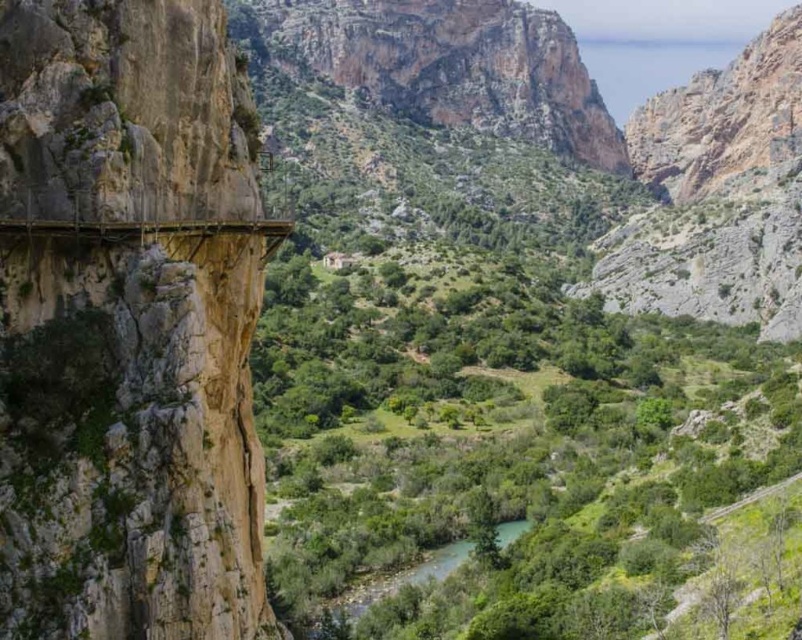
You are a hiker planning to cross the rough stone bridge at left and the green smooth river at center. Based on the scene, which one requires more caution due to its height?

The rough stone bridge at left requires more caution due to its much taller height compared to the green smooth river at center.

Consider the image. You are a hiker who needs to cross the rough stone bridge at left and the green smooth river at center. Which path has a narrower width for crossing?

The rough stone bridge at left has a lesser width compared to the green smooth river at center, so the rough stone bridge at left is narrower for crossing.